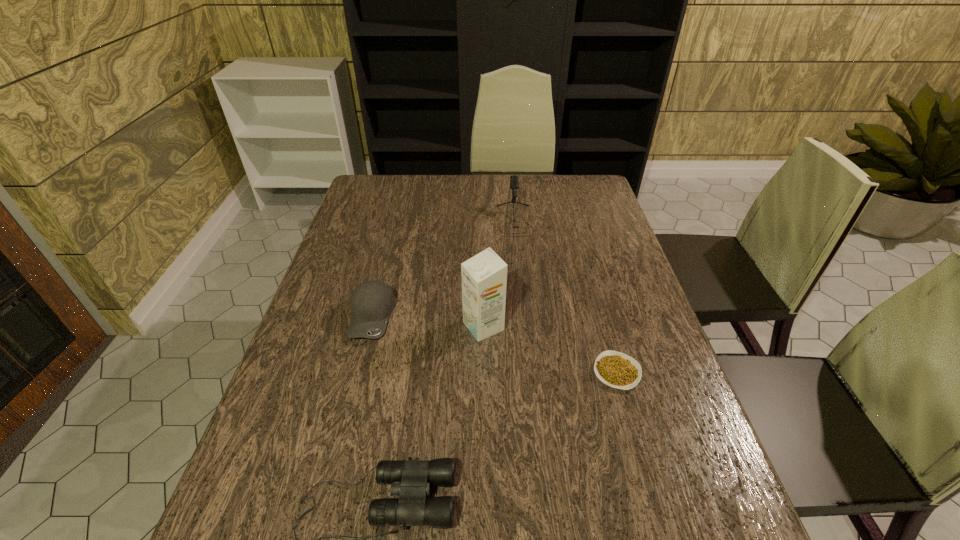
The image size is (960, 540). Find the location of `vacant area that lies between the legume and the third shortest object`. vacant area that lies between the legume and the third shortest object is located at coordinates (494, 345).

Choose which object is the fourth nearest neighbor to the rightmost object. Please provide its 2D coordinates. Your answer should be formatted as a tuple, i.e. [(x, y)], where the tuple contains the x and y coordinates of a point satisfying the conditions above.

[(372, 302)]

Image resolution: width=960 pixels, height=540 pixels. I want to click on object that is the closest to the baseball cap, so click(x=484, y=276).

Where is `blank space that satisfies the following two spatial constraints: 1. on the front brim of the carton; 2. on the left side of the baseball cap`? blank space that satisfies the following two spatial constraints: 1. on the front brim of the carton; 2. on the left side of the baseball cap is located at coordinates (370, 326).